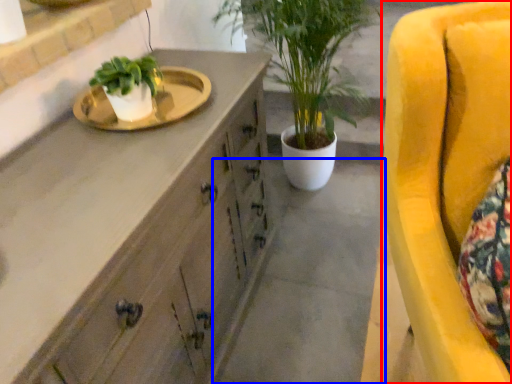
Question: Which point is further to the camera, chair (highlighted by a red box) or concrete (highlighted by a blue box)?

Choices:
 (A) chair
 (B) concrete

Answer: (B)